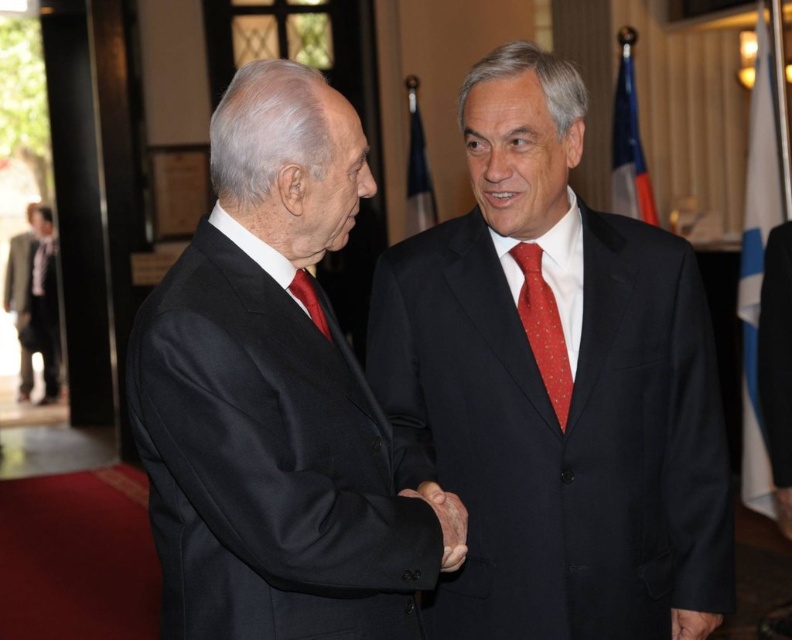
Who is positioned more to the left, black matte suit at center or red dotted silk tie at right?

black matte suit at center is more to the left.

Which is behind, point (231, 275) or point (543, 332)?

Positioned behind is point (543, 332).

Image resolution: width=792 pixels, height=640 pixels. I want to click on black matte suit at center, so click(x=275, y=397).

At what (x,y) coordinates should I click in order to perform the action: click on black matte suit at center. Please return your answer as a coordinate pair (x, y). The image size is (792, 640). Looking at the image, I should click on (275, 397).

Between matte black suit at center and matte red tie at center, which one is positioned higher?

Positioned higher is matte red tie at center.

Is matte black suit at center to the right of matte red tie at center from the viewer's perspective?

Indeed, matte black suit at center is positioned on the right side of matte red tie at center.

Between point (608, 452) and point (315, 317), which one is positioned in front?

Point (315, 317)

Locate an element on the screen. The width and height of the screenshot is (792, 640). matte black suit at center is located at coordinates (554, 387).

Does point (311, 324) come behind point (307, 308)?

No, it is not.

Which is in front, point (269, 467) or point (297, 292)?

Point (269, 467) is in front.

Measure the distance between point (366, 436) and camera.

Point (366, 436) is 1.62 meters away from camera.

Locate an element on the screen. black matte suit at center is located at coordinates (275, 397).